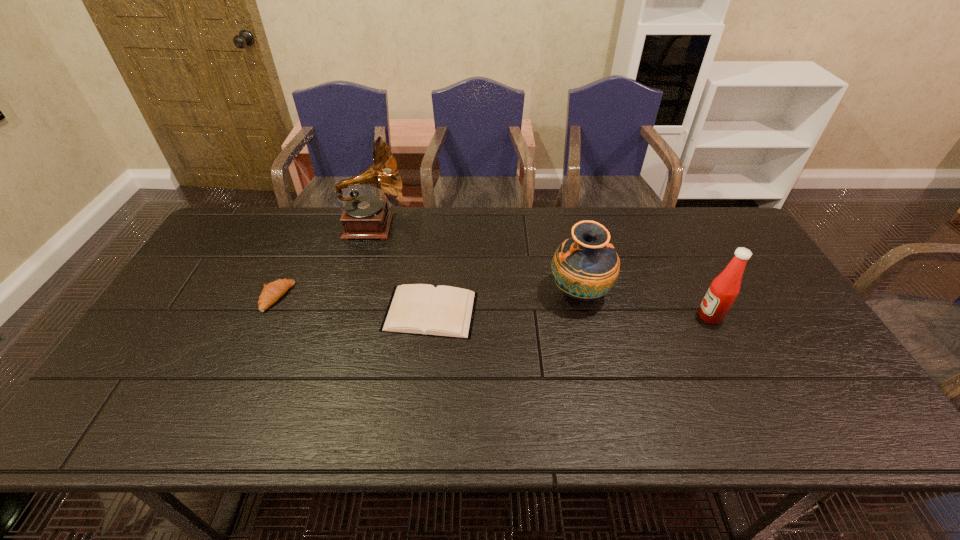
Locate an element on the screen. This screenshot has width=960, height=540. vacant position located 0.200m on the front-facing side of the condiment is located at coordinates (624, 316).

Where is `free space located on the front of the pottery`? The image size is (960, 540). free space located on the front of the pottery is located at coordinates (610, 426).

I want to click on vacant space located 0.280m on the back of the fourth tallest object, so click(x=309, y=224).

Identify the location of free space located 0.080m on the left of the hardback book. (354, 312).

Locate an element on the screen. object that is at the far edge is located at coordinates (365, 217).

Where is `free space at the far edge of the desktop`? The image size is (960, 540). free space at the far edge of the desktop is located at coordinates (430, 240).

Where is `vacant area at the near edge`? This screenshot has width=960, height=540. vacant area at the near edge is located at coordinates (169, 420).

Image resolution: width=960 pixels, height=540 pixels. In the image, there is a desktop. What are the coordinates of `vacant space at the left edge` in the screenshot? It's located at (250, 254).

Where is `free spot at the far left corner of the desktop`? The height and width of the screenshot is (540, 960). free spot at the far left corner of the desktop is located at coordinates (267, 210).

In the image, there is a desktop. Identify the location of vacant space at the far right corner. (721, 217).